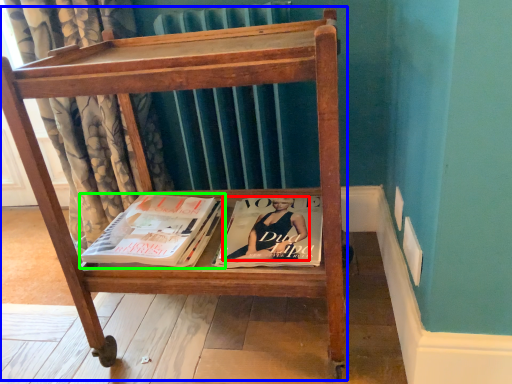
Question: Which object is positioned farthest from person (highlighted by a red box)? Select from furniture (highlighted by a blue box) and book (highlighted by a green box).

Choices:
 (A) furniture
 (B) book

Answer: (A)